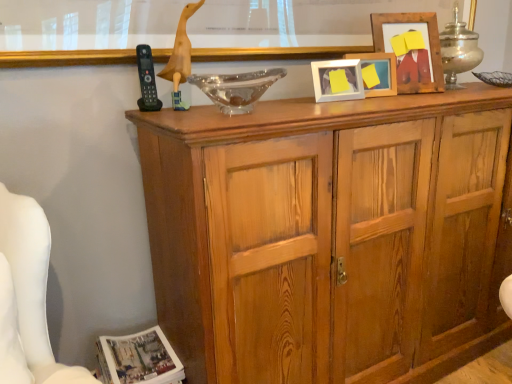
Identify the location of free spot in front of yellow matte picture frame at upper center, which ranks as the 2th picture frame in left-to-right order. The image size is (512, 384). coord(404,94).